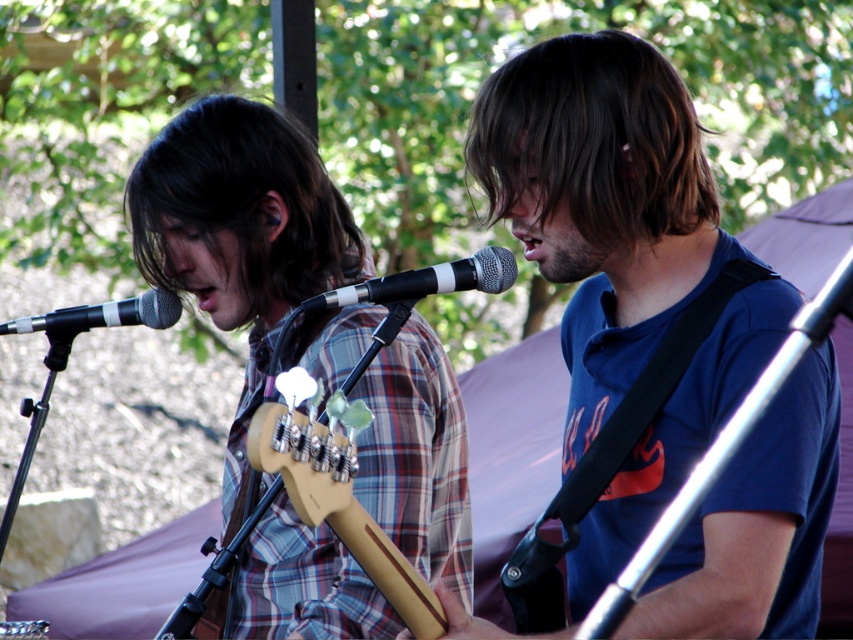
Question: Does dark brown straight hair at upper center come in front of black matte microphone at center?

Choices:
 (A) no
 (B) yes

Answer: (B)

Question: Does dark brown straight hair at upper center have a larger size compared to brown matte hair at center?

Choices:
 (A) no
 (B) yes

Answer: (A)

Question: Which of the following is the closest to the observer?

Choices:
 (A) blue cotton shirt at center
 (B) dark brown straight hair at upper center
 (C) matte black microphone at left
 (D) brown matte hair at center

Answer: (A)

Question: Which point is closer to the camera?

Choices:
 (A) (363, 291)
 (B) (231, 125)

Answer: (A)

Question: Which point is closer to the camera?

Choices:
 (A) (328, 296)
 (B) (49, 328)
 (C) (207, 179)
 (D) (616, 33)

Answer: (D)

Question: Does brown matte hair at center appear on the left side of black matte microphone at center?

Choices:
 (A) yes
 (B) no

Answer: (A)